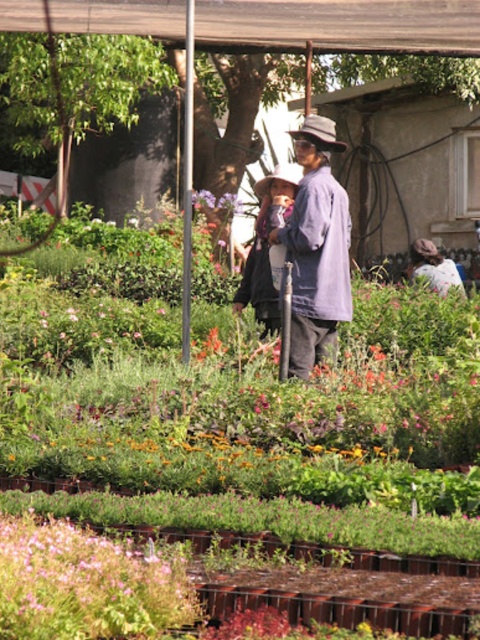
Question: Which object is farther from the camera taking this photo?

Choices:
 (A) pink matte flower at lower left
 (B) matte black jacket at center
 (C) matte gray fedora at center

Answer: (B)

Question: Estimate the real-world distances between objects in this image. Which object is farther from the pink matte flower at lower left?

Choices:
 (A) matte black jacket at center
 (B) matte gray fedora at center
 (C) denim shirt at center

Answer: (B)

Question: Is the position of wooden slats at upper center less distant than that of pink matte flower at lower left?

Choices:
 (A) yes
 (B) no

Answer: (B)

Question: Among these points, which one is nearest to the camera?

Choices:
 (A) (254, 188)
 (B) (289, 49)

Answer: (A)

Question: Is matte black jacket at center below matte gray fedora at center?

Choices:
 (A) no
 (B) yes

Answer: (B)

Question: Is denim shirt at center smaller than matte gray fedora at center?

Choices:
 (A) no
 (B) yes

Answer: (B)